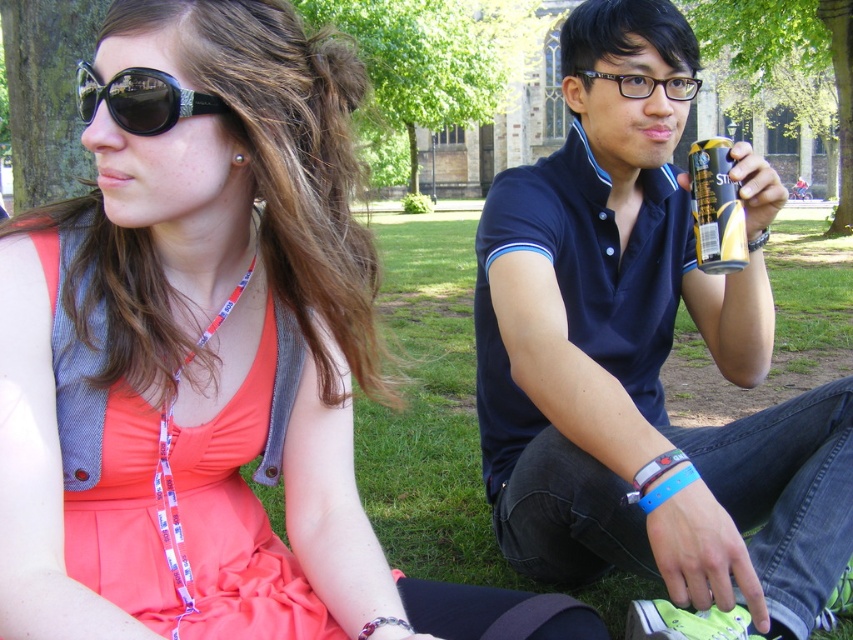
Is point (141, 124) farther from camera compared to point (709, 227)?

No, it is in front of (709, 227).

Can you confirm if black shiny sunglasses at upper left is positioned above black matte can at upper right?

Yes.

Does point (80, 113) come closer to viewer compared to point (722, 241)?

Yes, it is.

At what (x,y) coordinates should I click in order to perform the action: click on black shiny sunglasses at upper left. Please return your answer as a coordinate pair (x, y). The width and height of the screenshot is (853, 640). Looking at the image, I should click on (141, 99).

Does matte black sunglasses at upper left have a lesser width compared to blue fabric polo shirt at center?

In fact, matte black sunglasses at upper left might be wider than blue fabric polo shirt at center.

Is point (299, 621) closer to camera compared to point (650, 545)?

That is True.

Does point (155, 401) lie behind point (808, 472)?

No, it is not.

I want to click on matte black sunglasses at upper left, so click(x=207, y=355).

In the scene shown: Who is positioned more to the left, matte black sunglasses at upper left or black matte can at upper right?

Positioned to the left is matte black sunglasses at upper left.

Does matte black sunglasses at upper left appear under black matte can at upper right?

Yes.

Does point (285, 282) lie behind point (730, 272)?

No, it is not.

Where is `matte black sunglasses at upper left`? The height and width of the screenshot is (640, 853). matte black sunglasses at upper left is located at coordinates (207, 355).